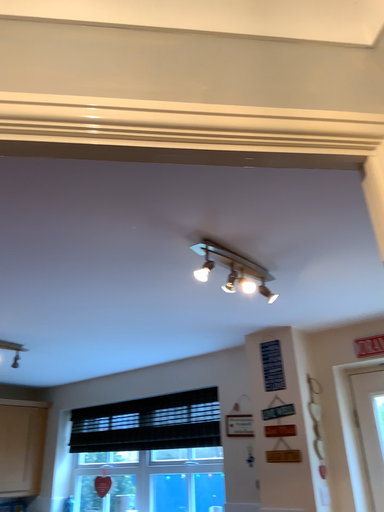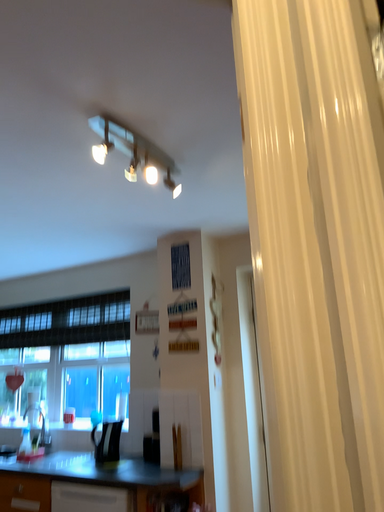
Question: How did the camera likely rotate when shooting the video?

Choices:
 (A) rotated left
 (B) rotated right

Answer: (B)